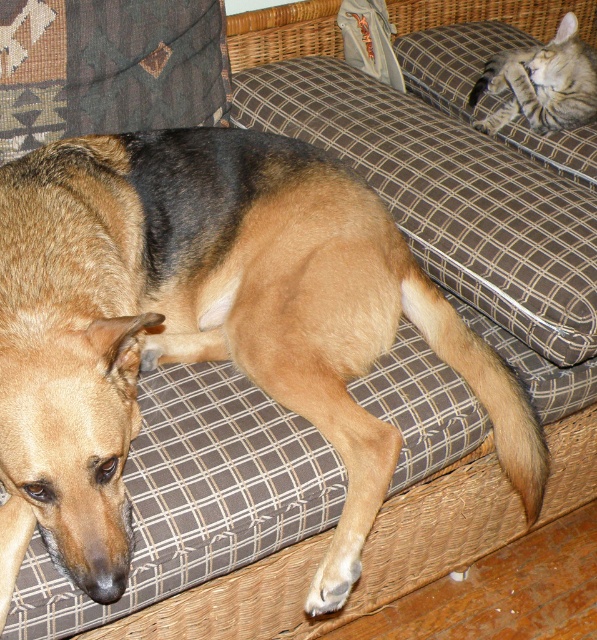
Can you confirm if golden-brown fur dog at center is positioned to the right of striped fur cat at upper right?

Incorrect, golden-brown fur dog at center is not on the right side of striped fur cat at upper right.

Is golden-brown fur dog at center positioned in front of striped fur cat at upper right?

Yes, it is.

Between point (327, 284) and point (581, 81), which one is positioned behind?

Positioned behind is point (581, 81).

At what (x,y) coordinates should I click in order to perform the action: click on golden-brown fur dog at center. Please return your answer as a coordinate pair (x, y). Looking at the image, I should click on (205, 328).